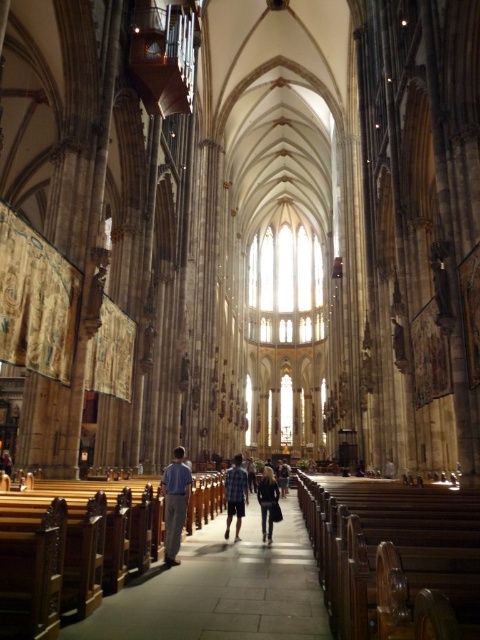
Question: Can you confirm if checkered fabric shirt at center is positioned below plaid shirt at center?

Choices:
 (A) no
 (B) yes

Answer: (A)

Question: Which point is closer to the camera?

Choices:
 (A) plaid shirt at center
 (B) dark blue jeans at center
 (C) light blue shirt at center
 (D) wooden pews at center

Answer: (D)

Question: Which of the following is the farthest from the observer?

Choices:
 (A) (271, 472)
 (B) (87, 625)
 (C) (285, 486)

Answer: (C)

Question: Can you confirm if wooden pews at center is positioned to the left of light blue shirt at center?

Choices:
 (A) yes
 (B) no

Answer: (B)

Question: Can you confirm if checkered fabric shirt at center is wider than plaid shirt at center?

Choices:
 (A) no
 (B) yes

Answer: (A)

Question: Which point appears farthest from the camera in this image?

Choices:
 (A) (261, 483)
 (B) (216, 548)
 (C) (230, 472)

Answer: (A)